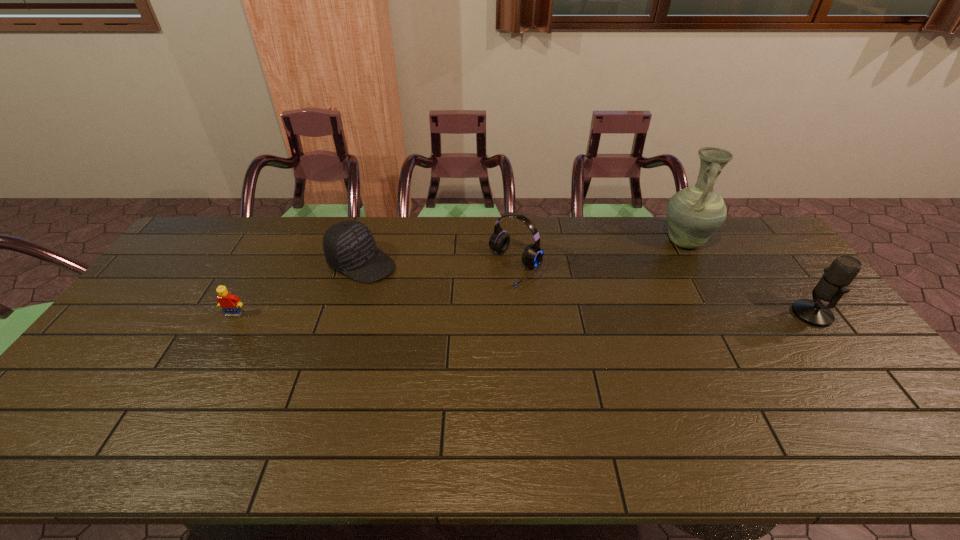
What are the coordinates of `free space located 0.260m at the front of the second object from left to right where the brim is located` in the screenshot? It's located at (454, 306).

Identify the location of vacant space located 0.050m at the front of the second object from left to right where the brim is located. (400, 280).

Locate an element on the screen. The height and width of the screenshot is (540, 960). free location located 0.370m on the ear cushions of the third object from right to left is located at coordinates (422, 364).

Find the location of a particular element. free space located 0.090m on the ear cushions of the third object from right to left is located at coordinates (484, 303).

Where is `free space located 0.090m on the ear cushions of the third object from right to left`? This screenshot has width=960, height=540. free space located 0.090m on the ear cushions of the third object from right to left is located at coordinates (484, 303).

At what (x,y) coordinates should I click in order to perform the action: click on vacant space located on the handle side of the pitcher. Please return your answer as a coordinate pair (x, y). Looking at the image, I should click on (655, 270).

You are a GUI agent. You are given a task and a screenshot of the screen. Output one action in this format:
    pyautogui.click(x=<x>, y=<y>)
    Task: Click on the vacant position located 0.110m on the handle side of the pitcher
    
    Given the screenshot: What is the action you would take?
    pyautogui.click(x=657, y=268)

The width and height of the screenshot is (960, 540). I want to click on vacant space located on the handle side of the pitcher, so click(x=613, y=309).

Locate an element on the screen. The image size is (960, 540). baseball cap that is at the far edge is located at coordinates (349, 246).

Where is `headset that is at the far edge`? The image size is (960, 540). headset that is at the far edge is located at coordinates (499, 241).